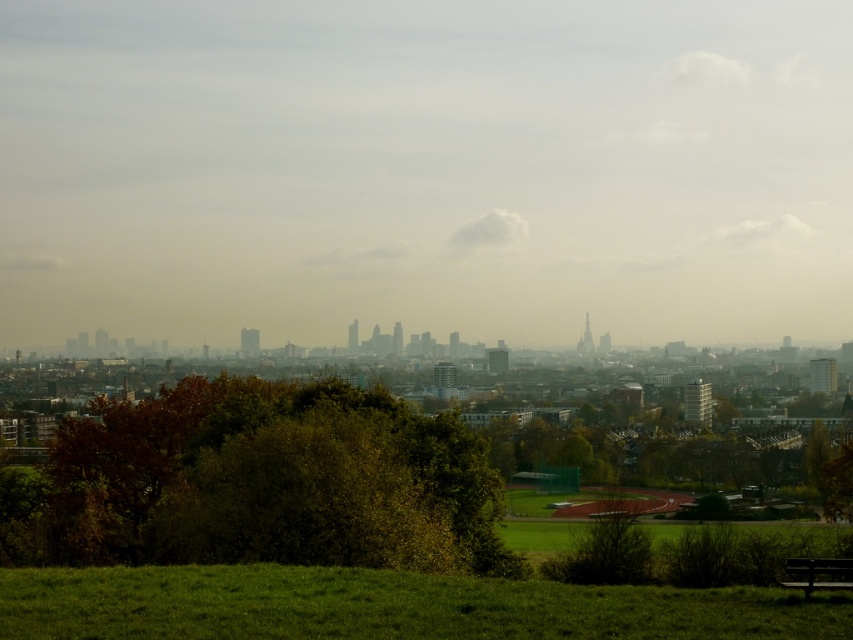
Question: Is green leafy tree at center below wooden bench at lower right?

Choices:
 (A) no
 (B) yes

Answer: (B)

Question: Which of the following is the closest to the observer?

Choices:
 (A) pos(410,621)
 (B) pos(386,467)
 (C) pos(849,580)

Answer: (A)

Question: Is green leafy tree at center positioned in front of green grassy field at lower center?

Choices:
 (A) yes
 (B) no

Answer: (B)

Question: Considering the real-world distances, which object is closest to the green grassy field at lower center?

Choices:
 (A) green leafy tree at center
 (B) wooden bench at lower right

Answer: (B)

Question: Is green grassy field at lower center thinner than wooden bench at lower right?

Choices:
 (A) yes
 (B) no

Answer: (B)

Question: Which point appears farthest from the camera in this image?

Choices:
 (A) (793, 586)
 (B) (310, 605)
 (C) (68, 476)

Answer: (C)